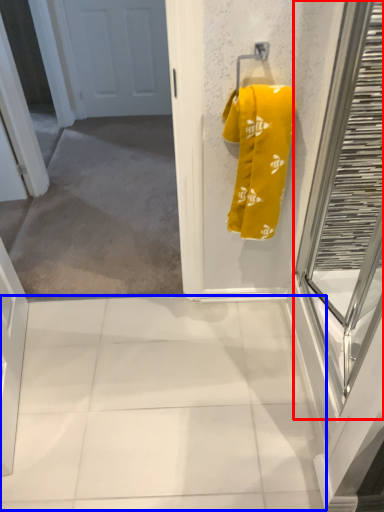
Question: Which of the following is the farthest to the observer, glass door (highlighted by a red box) or tile (highlighted by a blue box)?

Choices:
 (A) glass door
 (B) tile

Answer: (B)